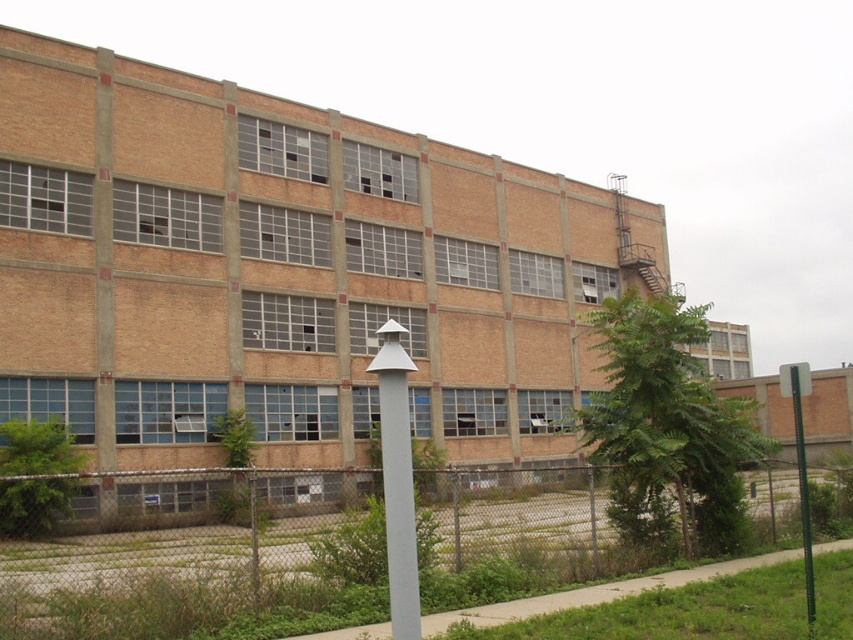
Question: Is white matte pole at center thinner than green metallic pole at right?

Choices:
 (A) no
 (B) yes

Answer: (B)

Question: Is brown brick building at center to the right of chain-link fence at lower center from the viewer's perspective?

Choices:
 (A) yes
 (B) no

Answer: (A)

Question: Does white matte pole at center have a lesser width compared to green metallic pole at right?

Choices:
 (A) no
 (B) yes

Answer: (B)

Question: Which object is positioned closest to the green metallic pole at right?

Choices:
 (A) chain-link fence at lower center
 (B) white matte pole at center

Answer: (A)

Question: Which point is farther to the camera?

Choices:
 (A) (801, 433)
 (B) (540, 237)

Answer: (A)

Question: Based on their relative distances, which object is farther from the chain-link fence at lower center?

Choices:
 (A) green metallic pole at right
 (B) brown brick building at center
 (C) white matte pole at center

Answer: (B)